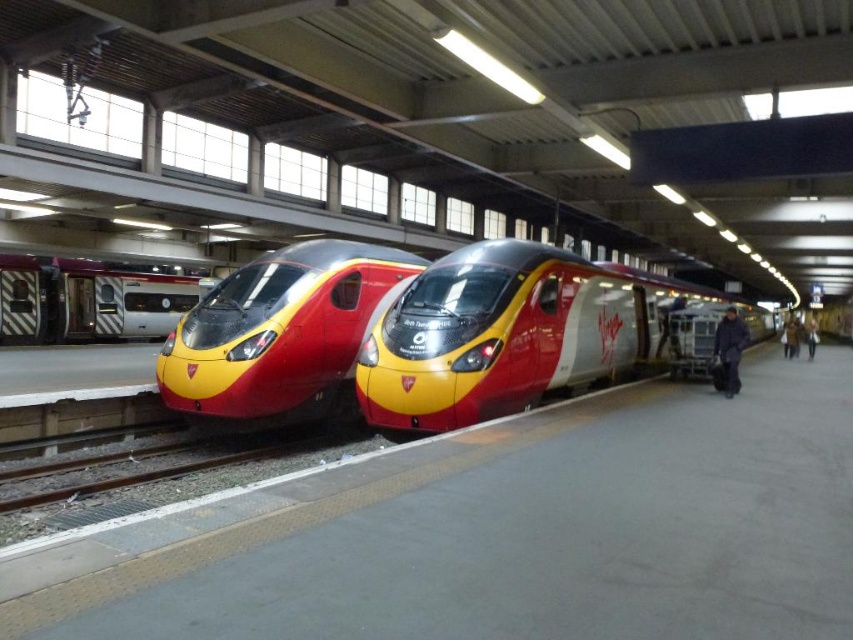
Question: Is red/yellow glossy train at center to the left of silver metallic train at left from the viewer's perspective?

Choices:
 (A) yes
 (B) no

Answer: (B)

Question: Is red/yellow glossy train at center behind matte red/yellow train at center?

Choices:
 (A) no
 (B) yes

Answer: (A)

Question: Among these points, which one is nearest to the camera?

Choices:
 (A) (198, 403)
 (B) (468, 358)
 (C) (99, 280)

Answer: (B)

Question: In this image, where is red/yellow glossy train at center located relative to matte red/yellow train at center?

Choices:
 (A) right
 (B) left

Answer: (A)

Question: Which of the following is the farthest from the observer?

Choices:
 (A) red/yellow glossy train at center
 (B) silver metallic train at left
 (C) matte red/yellow train at center

Answer: (B)

Question: Which object appears closest to the camera in this image?

Choices:
 (A) silver metallic train at left
 (B) matte red/yellow train at center

Answer: (B)